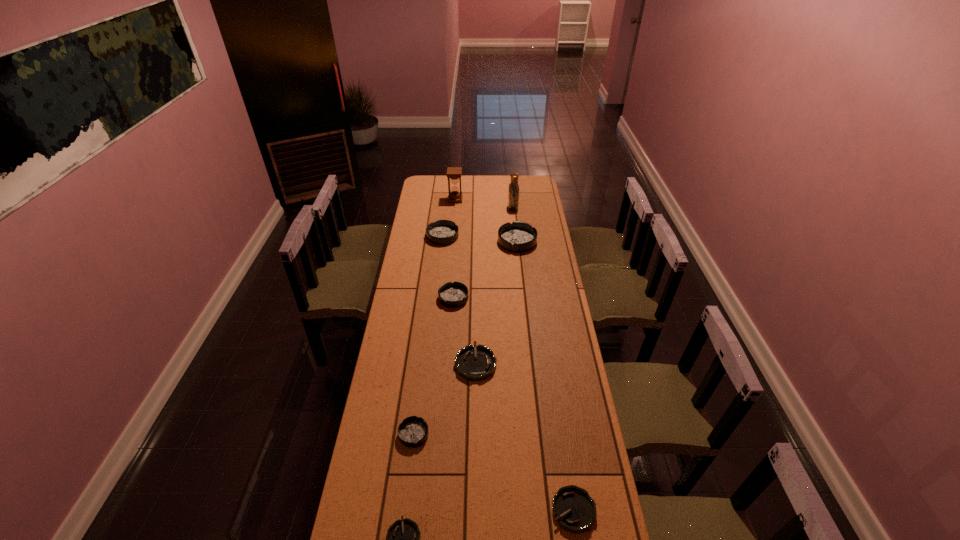
Where is `vacant position located 0.090m on the left of the fifth farthest object`? The height and width of the screenshot is (540, 960). vacant position located 0.090m on the left of the fifth farthest object is located at coordinates (420, 298).

At what (x,y) coordinates should I click in order to perform the action: click on vacant space located 0.150m on the back of the second green ashtray from right to left. Please return your answer as a coordinate pair (x, y). The height and width of the screenshot is (540, 960). Looking at the image, I should click on (476, 320).

Locate an element on the screen. The width and height of the screenshot is (960, 540). blank space located on the back of the smallest dark ashtray is located at coordinates (420, 384).

What are the coordinates of `vacant space situated on the left of the second shortest object` in the screenshot? It's located at (471, 510).

Where is `vacant region at the far edge of the desktop`? This screenshot has width=960, height=540. vacant region at the far edge of the desktop is located at coordinates (468, 191).

Find the location of `free space at the left edge`. free space at the left edge is located at coordinates (403, 295).

Where is `free space at the right edge`? The image size is (960, 540). free space at the right edge is located at coordinates (532, 271).

What are the coordinates of `free space between the vodka and the third nearest object` in the screenshot? It's located at (464, 321).

Locate an element on the screen. This screenshot has width=960, height=540. empty location between the smallest dark ashtray and the vodka is located at coordinates (464, 321).

In order to click on unoccupied area between the farthest object and the second farthest object in this screenshot , I will do `click(484, 204)`.